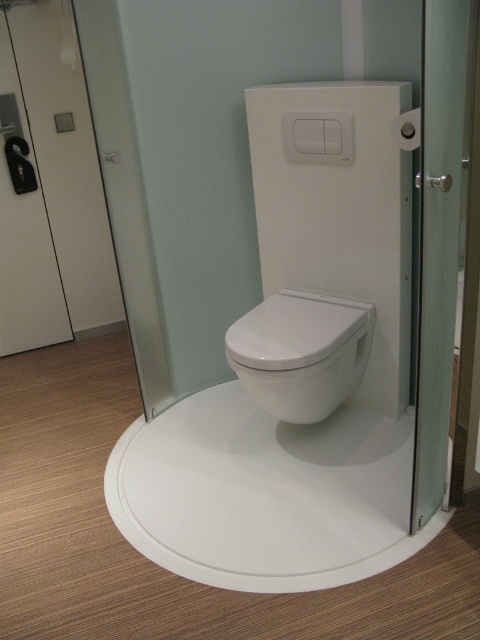
Is white glossy toilet seat at center shorter than transparent glass screen door at right?

Correct, white glossy toilet seat at center is not as tall as transparent glass screen door at right.

Is white glossy toilet seat at center further to camera compared to transparent glass screen door at right?

Yes, white glossy toilet seat at center is behind transparent glass screen door at right.

Is point (352, 275) positioned after point (439, 378)?

Yes, it is behind point (439, 378).

The image size is (480, 640). In order to click on white glossy toilet seat at center in this screenshot , I will do `click(330, 246)`.

From the picture: Is the position of white glossy toilet seat at center more distant than that of white glossy toilet at center?

No, white glossy toilet seat at center is in front of white glossy toilet at center.

Does white glossy toilet seat at center have a smaller size compared to white glossy toilet at center?

Incorrect, white glossy toilet seat at center is not smaller in size than white glossy toilet at center.

Between point (277, 211) and point (337, 326), which one is positioned in front?

Point (337, 326) is more forward.

At what (x,y) coordinates should I click in order to perform the action: click on white glossy toilet seat at center. Please return your answer as a coordinate pair (x, y). The image size is (480, 640). Looking at the image, I should click on (330, 246).

From the picture: Can you confirm if transparent glass screen door at right is smaller than white glossy toilet at center?

No, transparent glass screen door at right is not smaller than white glossy toilet at center.

Can you confirm if transparent glass screen door at right is positioned to the left of white glossy toilet at center?

In fact, transparent glass screen door at right is to the right of white glossy toilet at center.

Is point (460, 88) positioned after point (363, 310)?

No, (460, 88) is in front of (363, 310).

What are the coordinates of `transparent glass screen door at right` in the screenshot? It's located at (440, 230).